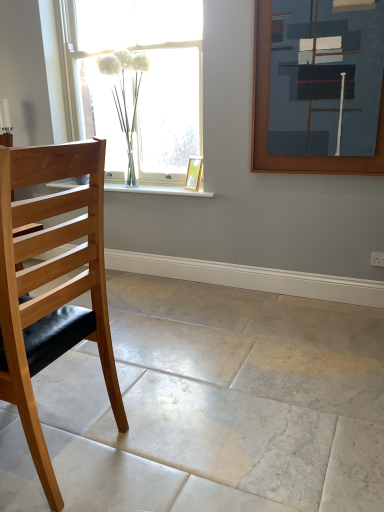
Locate an element on the screen. The width and height of the screenshot is (384, 512). vacant point to the right of light wood/black leather chair at left is located at coordinates (158, 438).